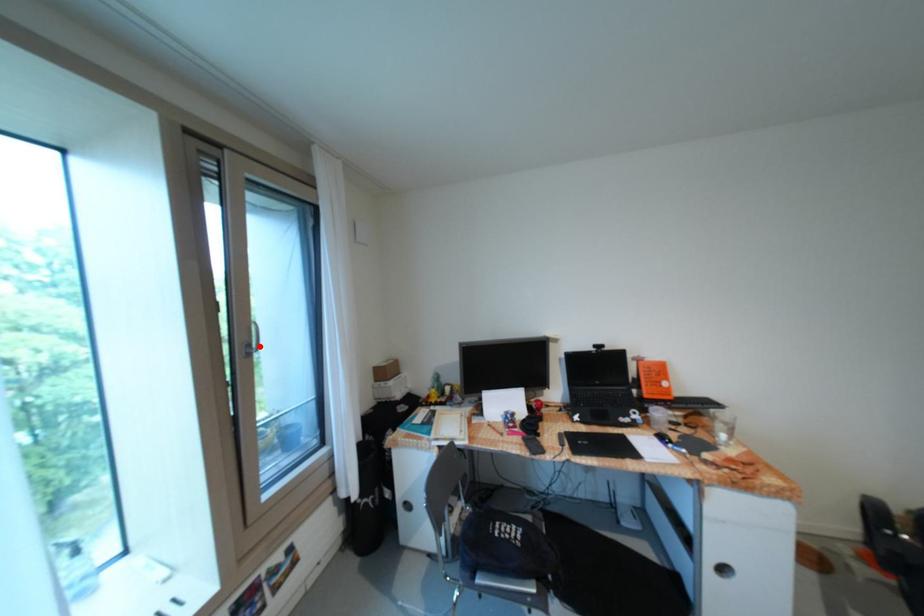
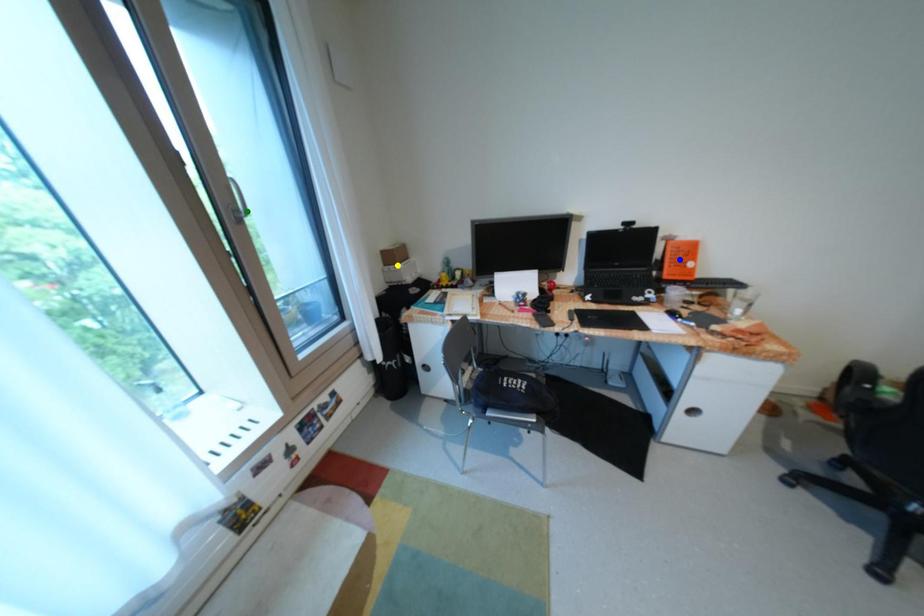
Question: I am providing you with two images of the same scene from different viewpoints. A red point is marked on the first image. You are given multiple points on the second image. Which point in image 2 represents the same 3d spot as the red point in image 1?

Choices:
 (A) yellow point
 (B) blue point
 (C) green point

Answer: (C)